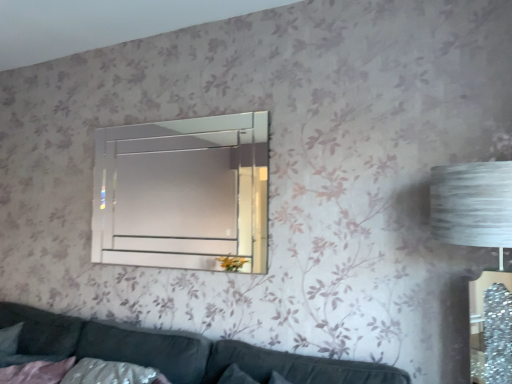
Identify the location of velvet dark grey couch at lower center. Image resolution: width=512 pixels, height=384 pixels. (180, 351).

The width and height of the screenshot is (512, 384). What do you see at coordinates (180, 351) in the screenshot? I see `velvet dark grey couch at lower center` at bounding box center [180, 351].

The width and height of the screenshot is (512, 384). What do you see at coordinates (183, 193) in the screenshot? I see `clear glass mirror at upper center` at bounding box center [183, 193].

Measure the distance between point (217, 131) and camera.

Point (217, 131) and camera are 2.06 meters apart.

Locate an element on the screen. clear glass mirror at upper center is located at coordinates (183, 193).

Where is `velvet dark grey couch at lower center`? This screenshot has width=512, height=384. velvet dark grey couch at lower center is located at coordinates (180, 351).

Does velvet dark grey couch at lower center appear on the left side of clear glass mirror at upper center?

In fact, velvet dark grey couch at lower center is to the right of clear glass mirror at upper center.

Which object is more forward, velvet dark grey couch at lower center or clear glass mirror at upper center?

Positioned in front is velvet dark grey couch at lower center.

Which is more distant, (99, 328) or (187, 244)?

Point (187, 244)

From the image's perspective, relative to clear glass mirror at upper center, is velvet dark grey couch at lower center above or below?

velvet dark grey couch at lower center is situated lower than clear glass mirror at upper center in the image.

From a real-world perspective, who is located higher, velvet dark grey couch at lower center or clear glass mirror at upper center?

In real-world perspective, clear glass mirror at upper center is above.

Is velvet dark grey couch at lower center thinner than clear glass mirror at upper center?

No.

Considering the sizes of objects velvet dark grey couch at lower center and clear glass mirror at upper center in the image provided, who is taller, velvet dark grey couch at lower center or clear glass mirror at upper center?

Standing taller between the two is clear glass mirror at upper center.

Does velvet dark grey couch at lower center have a larger size compared to clear glass mirror at upper center?

Yes, velvet dark grey couch at lower center is bigger than clear glass mirror at upper center.

Is velvet dark grey couch at lower center outside of clear glass mirror at upper center?

Yes, velvet dark grey couch at lower center is outside of clear glass mirror at upper center.

Is velvet dark grey couch at lower center positioned far away from clear glass mirror at upper center?

Indeed, velvet dark grey couch at lower center is not near clear glass mirror at upper center.

Consider the image. Is velvet dark grey couch at lower center facing away from clear glass mirror at upper center?

No, velvet dark grey couch at lower center is not facing the opposite direction of clear glass mirror at upper center.

What's the angular difference between velvet dark grey couch at lower center and clear glass mirror at upper center's facing directions?

velvet dark grey couch at lower center and clear glass mirror at upper center are facing 1.26 degrees away from each other.

This screenshot has height=384, width=512. I want to click on window to the left of velvet dark grey couch at lower center, so click(183, 193).

Which object is positioned more to the left, clear glass mirror at upper center or velvet dark grey couch at lower center?

clear glass mirror at upper center is more to the left.

Based on the photo, does clear glass mirror at upper center come behind velvet dark grey couch at lower center?

Yes, clear glass mirror at upper center is behind velvet dark grey couch at lower center.

Does point (145, 213) come closer to viewer compared to point (2, 324)?

No, (145, 213) is further to viewer.

From the image's perspective, who appears lower, clear glass mirror at upper center or velvet dark grey couch at lower center?

From the image's view, velvet dark grey couch at lower center is below.

From a real-world perspective, is clear glass mirror at upper center over velvet dark grey couch at lower center?

Correct, in the physical world, clear glass mirror at upper center is higher than velvet dark grey couch at lower center.

Considering the sizes of objects clear glass mirror at upper center and velvet dark grey couch at lower center in the image provided, who is thinner, clear glass mirror at upper center or velvet dark grey couch at lower center?

clear glass mirror at upper center.

From the picture: Does clear glass mirror at upper center have a lesser height compared to velvet dark grey couch at lower center?

Incorrect, the height of clear glass mirror at upper center does not fall short of that of velvet dark grey couch at lower center.

From the picture: Does clear glass mirror at upper center have a larger size compared to velvet dark grey couch at lower center?

No, clear glass mirror at upper center is not bigger than velvet dark grey couch at lower center.

Can velvet dark grey couch at lower center be found inside clear glass mirror at upper center?

No, velvet dark grey couch at lower center is located outside of clear glass mirror at upper center.

Looking at this image, is the surface of clear glass mirror at upper center in direct contact with velvet dark grey couch at lower center?

No, clear glass mirror at upper center is not with velvet dark grey couch at lower center.

Could you tell me if clear glass mirror at upper center is facing velvet dark grey couch at lower center?

No, clear glass mirror at upper center is not turned towards velvet dark grey couch at lower center.

From the picture: Measure the distance from clear glass mirror at upper center to velvet dark grey couch at lower center.

clear glass mirror at upper center is 2.34 meters from velvet dark grey couch at lower center.

The height and width of the screenshot is (384, 512). Identify the location of studio couch to the right of clear glass mirror at upper center. (180, 351).

Where is `studio couch located in front of the clear glass mirror at upper center`? studio couch located in front of the clear glass mirror at upper center is located at coordinates (180, 351).

The width and height of the screenshot is (512, 384). I want to click on studio couch on the right of clear glass mirror at upper center, so click(180, 351).